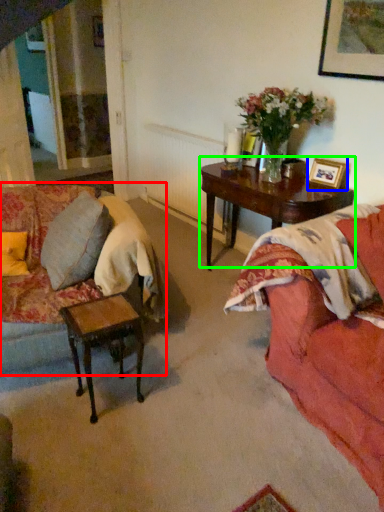
Question: Which object is positioned farthest from studio couch (highlighted by a red box)? Select from picture frame (highlighted by a blue box) and coffee table (highlighted by a green box).

Choices:
 (A) picture frame
 (B) coffee table

Answer: (A)